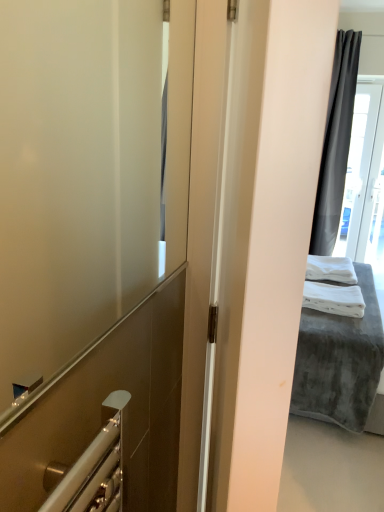
Identify the location of free space above white soft towel at right, the first bath towel positioned from the front (from a real-world perspective). This screenshot has width=384, height=512. (333, 287).